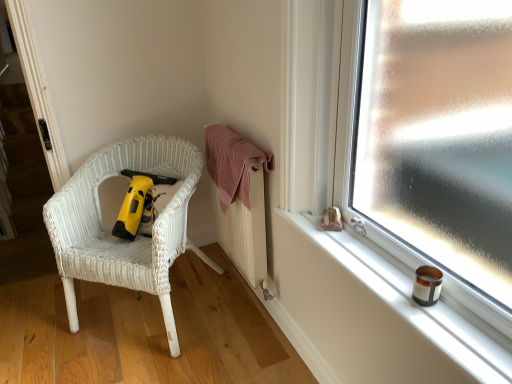
Question: Is pink cotton towel at center positioned behind smooth white window sill at right?

Choices:
 (A) yes
 (B) no

Answer: (A)

Question: Does pink cotton towel at center have a lesser width compared to smooth white window sill at right?

Choices:
 (A) yes
 (B) no

Answer: (B)

Question: From a real-world perspective, is pink cotton towel at center positioned over smooth white window sill at right based on gravity?

Choices:
 (A) yes
 (B) no

Answer: (A)

Question: Considering the relative sizes of pink cotton towel at center and smooth white window sill at right in the image provided, is pink cotton towel at center taller than smooth white window sill at right?

Choices:
 (A) yes
 (B) no

Answer: (A)

Question: Can you confirm if pink cotton towel at center is shorter than smooth white window sill at right?

Choices:
 (A) yes
 (B) no

Answer: (B)

Question: Can we say pink cotton towel at center lies outside smooth white window sill at right?

Choices:
 (A) yes
 (B) no

Answer: (A)

Question: Is smooth white window sill at right bigger than yellow plastic vacuum at left?

Choices:
 (A) yes
 (B) no

Answer: (B)

Question: Considering the relative sizes of smooth white window sill at right and yellow plastic vacuum at left in the image provided, is smooth white window sill at right thinner than yellow plastic vacuum at left?

Choices:
 (A) yes
 (B) no

Answer: (A)

Question: Is smooth white window sill at right positioned behind yellow plastic vacuum at left?

Choices:
 (A) no
 (B) yes

Answer: (A)

Question: From a real-world perspective, is smooth white window sill at right located beneath yellow plastic vacuum at left?

Choices:
 (A) yes
 (B) no

Answer: (B)

Question: From a real-world perspective, is smooth white window sill at right positioned over yellow plastic vacuum at left based on gravity?

Choices:
 (A) yes
 (B) no

Answer: (A)

Question: From the image's perspective, is smooth white window sill at right under yellow plastic vacuum at left?

Choices:
 (A) no
 (B) yes

Answer: (B)

Question: Is yellow plastic vacuum at left to the right of smooth white window sill at right from the viewer's perspective?

Choices:
 (A) no
 (B) yes

Answer: (A)